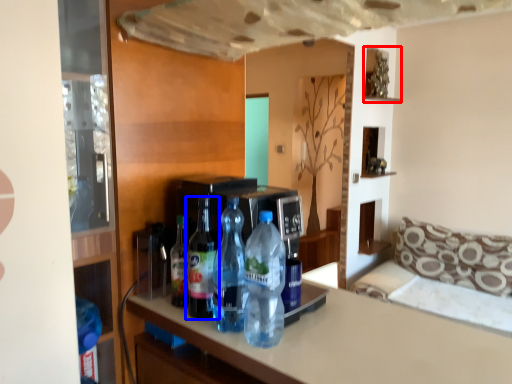
Question: Which of the following is the closest to the observer, shelf (highlighted by a red box) or bottle (highlighted by a blue box)?

Choices:
 (A) shelf
 (B) bottle

Answer: (B)